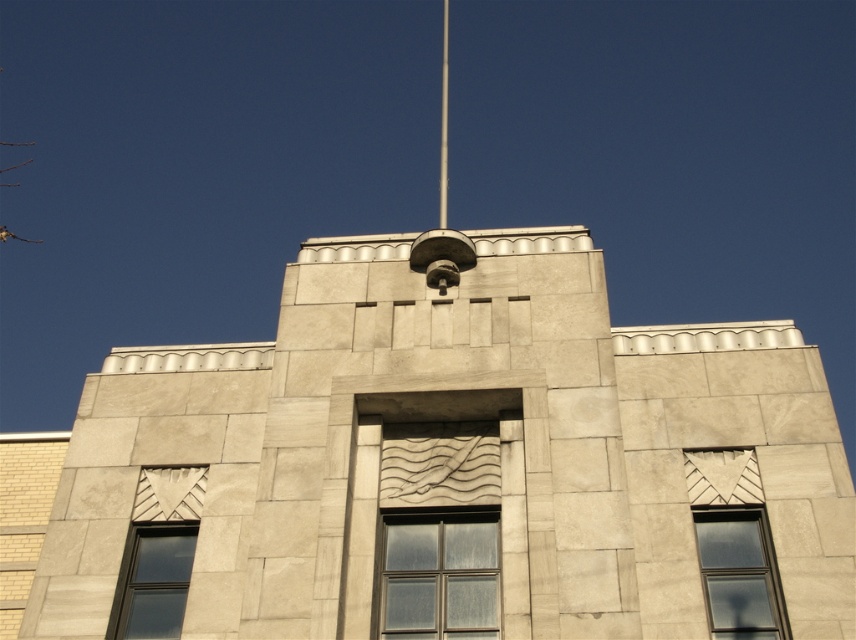
Which is above, beige stone tower at center or matte glass window at lower right?

beige stone tower at center

Which is in front, point (158, 504) or point (718, 552)?

Point (718, 552) is more forward.

I want to click on beige stone tower at center, so click(x=438, y=452).

Measure the distance between matte glass window at lower right and camera.

matte glass window at lower right and camera are 22.73 meters apart.

Is point (728, 520) positioned in front of point (134, 529)?

Yes.

Locate an element on the screen. This screenshot has width=856, height=640. matte glass window at lower right is located at coordinates (738, 576).

Can you confirm if clear glass window at center is positioned above matte glass window at lower right?

No, clear glass window at center is not above matte glass window at lower right.

Is clear glass window at center to the right of matte glass window at lower right from the viewer's perspective?

In fact, clear glass window at center is to the left of matte glass window at lower right.

Which is in front, point (491, 582) or point (749, 566)?

Point (491, 582)

Locate an element on the screen. The image size is (856, 640). clear glass window at center is located at coordinates (438, 577).